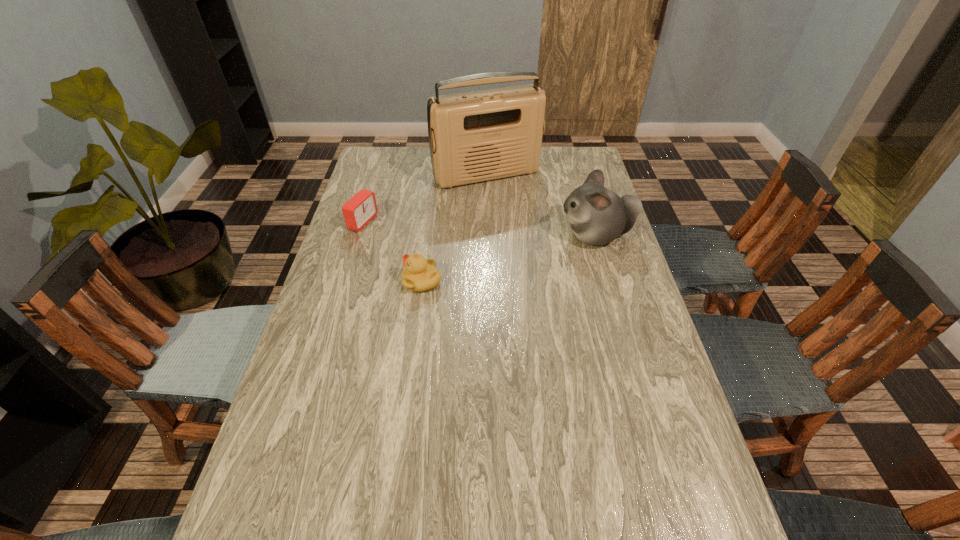
Locate an element on the screen. vacant space located on the face of the hamster is located at coordinates (436, 235).

Find the location of a particular element. This screenshot has height=540, width=960. free space located on the face of the hamster is located at coordinates (538, 235).

What are the coordinates of `vacant space located on the front-facing side of the leftmost object` in the screenshot? It's located at (437, 247).

Where is `vacant space located on the front-facing side of the leftmost object`? The width and height of the screenshot is (960, 540). vacant space located on the front-facing side of the leftmost object is located at coordinates (413, 239).

This screenshot has height=540, width=960. Identify the location of free spot located 0.230m on the front-facing side of the leftmost object. (434, 246).

Image resolution: width=960 pixels, height=540 pixels. In order to click on vacant space located 0.200m on the front-facing side of the tallest object in this screenshot , I will do `click(525, 222)`.

The width and height of the screenshot is (960, 540). What are the coordinates of `free spot located on the front-facing side of the tallest object` in the screenshot? It's located at (535, 239).

The height and width of the screenshot is (540, 960). I want to click on free spot located 0.080m on the front-facing side of the tallest object, so click(x=512, y=202).

Where is `object located at the far edge`? object located at the far edge is located at coordinates (475, 136).

In order to click on object that is at the left edge in this screenshot , I will do `click(361, 208)`.